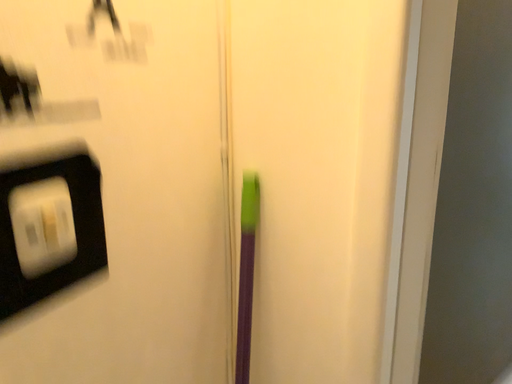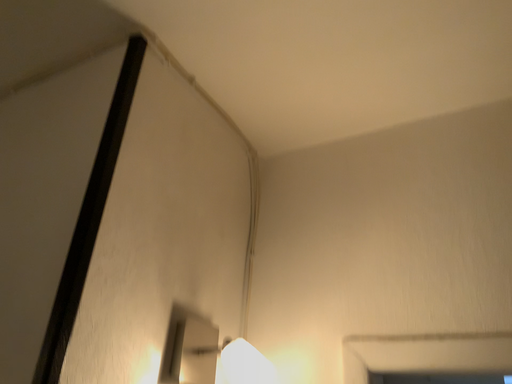
Question: Which way did the camera rotate in the video?

Choices:
 (A) rotated upward
 (B) rotated downward

Answer: (A)